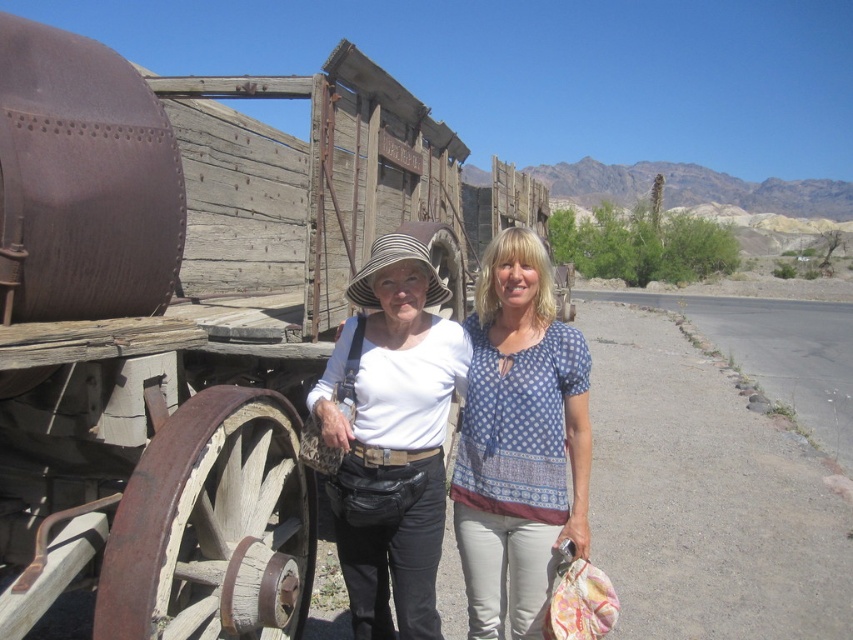
Is rusty wood wagon at center positioned before blue dotted blouse at center?

Yes, rusty wood wagon at center is in front of blue dotted blouse at center.

Measure the distance between point (233, 204) and camera.

Point (233, 204) and camera are 6.54 meters apart.

Where is `rusty wood wagon at center`? Image resolution: width=853 pixels, height=640 pixels. rusty wood wagon at center is located at coordinates (190, 316).

The width and height of the screenshot is (853, 640). What do you see at coordinates (190, 316) in the screenshot?
I see `rusty wood wagon at center` at bounding box center [190, 316].

Find the location of a particular element. This screenshot has width=853, height=640. rusty wood wagon at center is located at coordinates (190, 316).

This screenshot has width=853, height=640. Describe the element at coordinates (190, 316) in the screenshot. I see `rusty wood wagon at center` at that location.

The width and height of the screenshot is (853, 640). I want to click on rusty wood wagon at center, so click(190, 316).

Is point (294, 163) behind point (439, 301)?

Yes.

Between rusty wood wagon at center and striped fabric cowboy hat at center, which one appears on the right side from the viewer's perspective?

From the viewer's perspective, striped fabric cowboy hat at center appears more on the right side.

In order to click on rusty wood wagon at center in this screenshot , I will do `click(190, 316)`.